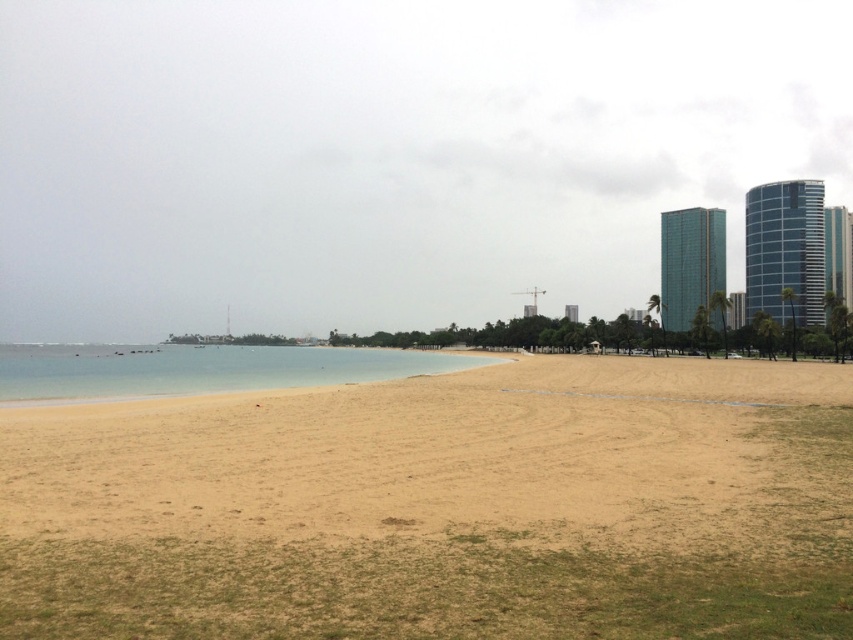
Who is taller, smooth sand beach at center or clear water at beach left?

clear water at beach left

Who is shorter, smooth sand beach at center or clear water at beach left?

smooth sand beach at center is shorter.

You are a GUI agent. You are given a task and a screenshot of the screen. Output one action in this format:
    pyautogui.click(x=<x>, y=<y>)
    Task: Click on the smooth sand beach at center
    The image size is (853, 640).
    Given the screenshot: What is the action you would take?
    pyautogui.click(x=440, y=506)